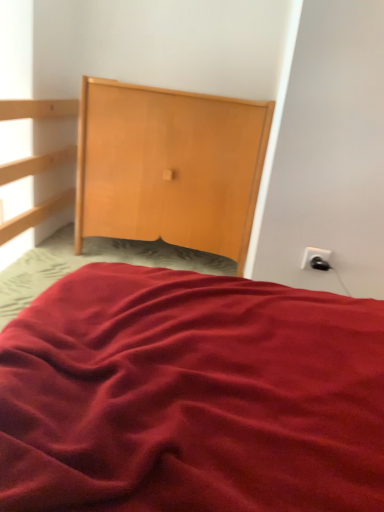
Question: Based on their sizes in the image, would you say white plastic socket at upper right is bigger or smaller than wooden dresser at upper center?

Choices:
 (A) small
 (B) big

Answer: (A)

Question: Visually, is white plastic socket at upper right positioned to the left or to the right of wooden dresser at upper center?

Choices:
 (A) left
 (B) right

Answer: (B)

Question: Relative to wooden dresser at upper center, is white plastic socket at upper right in front or behind?

Choices:
 (A) behind
 (B) front

Answer: (B)

Question: Does point (139, 91) appear closer or farther from the camera than point (306, 264)?

Choices:
 (A) farther
 (B) closer

Answer: (A)

Question: In terms of size, does wooden dresser at upper center appear bigger or smaller than white plastic socket at upper right?

Choices:
 (A) small
 (B) big

Answer: (B)

Question: From a real-world perspective, is wooden dresser at upper center above or below white plastic socket at upper right?

Choices:
 (A) above
 (B) below

Answer: (A)

Question: Would you say wooden dresser at upper center is to the left or to the right of white plastic socket at upper right in the picture?

Choices:
 (A) left
 (B) right

Answer: (A)